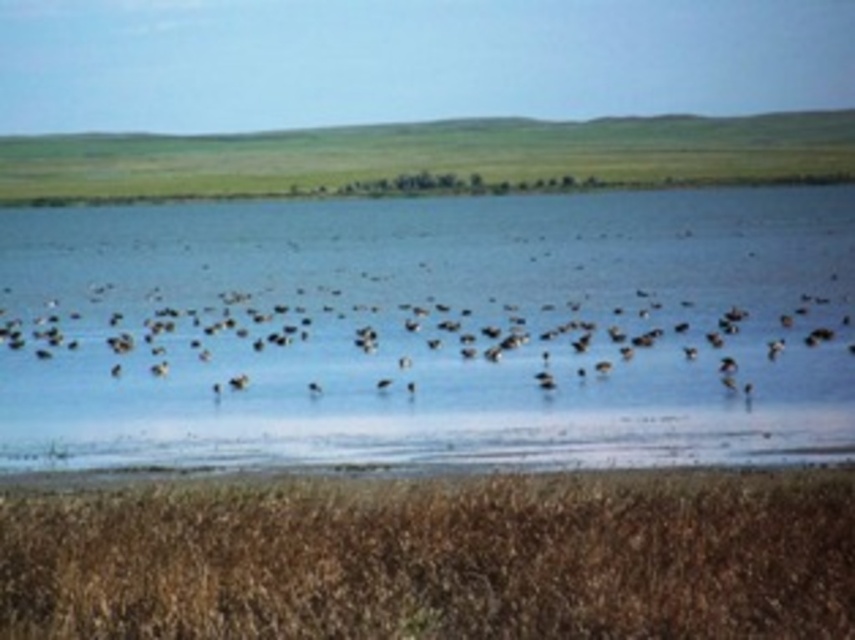
You are standing at the edge of the scene and want to walk towards the clear blue water at center. However, there is brown grass at lower center in your path. Considering their widths, which area would you need to step over first?

The brown grass at lower center must be stepped over first since it is narrower than the clear blue water at center, which is wider and further away.

You are standing at the edge of the lake and want to reach both the point at coordinates point (x=103, y=224) and point (x=140, y=525). Which point should you walk towards first if you want to reach the one closer to you?

You should walk towards point (x=103, y=224) first because it is closer to you than point (x=140, y=525).